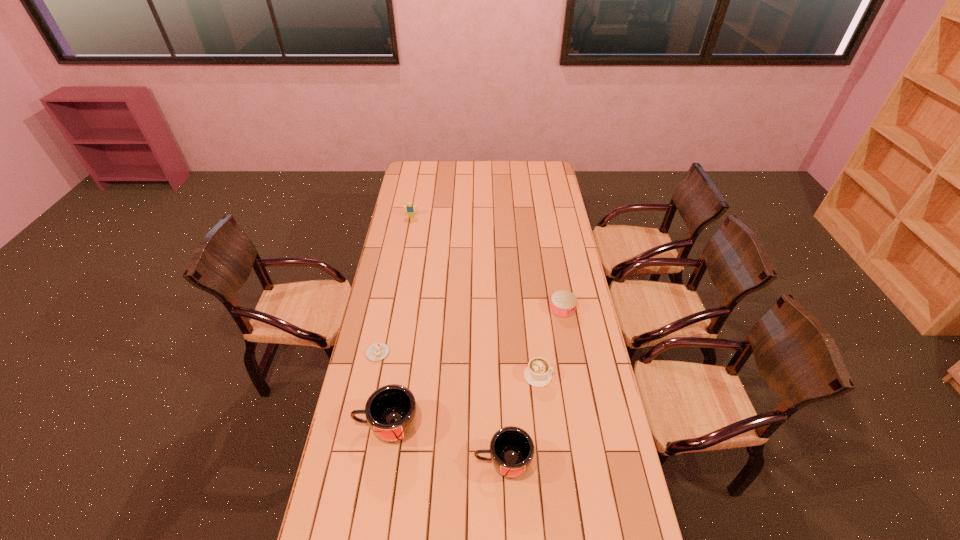
You are a GUI agent. You are given a task and a screenshot of the screen. Output one action in this format:
    pyautogui.click(x=<x>, y=<y>)
    Task: Click on the cupcake
    
    Given the screenshot: What is the action you would take?
    pyautogui.click(x=377, y=351)

This screenshot has width=960, height=540. I want to click on blank space located 0.290m on the side of the right mug with the handle, so click(x=385, y=462).

The height and width of the screenshot is (540, 960). Find the location of `blank space located on the side of the right mug with the handle`. blank space located on the side of the right mug with the handle is located at coordinates (400, 462).

The image size is (960, 540). Identify the location of free location located on the side of the right mug with the handle. (375, 462).

Find the location of a particular element. free location located on the face of the Lego is located at coordinates (406, 243).

I want to click on free space located 0.190m to the right of the cappuccino's handle, so click(603, 376).

The image size is (960, 540). Identify the location of free spot located 0.170m on the front of the can. (570, 351).

The width and height of the screenshot is (960, 540). I want to click on free space located 0.180m on the front of the cupcake, so click(x=368, y=404).

Where is `mug that is at the left edge`? mug that is at the left edge is located at coordinates (391, 411).

Where is `Lego that is at the left edge`? This screenshot has width=960, height=540. Lego that is at the left edge is located at coordinates (410, 209).